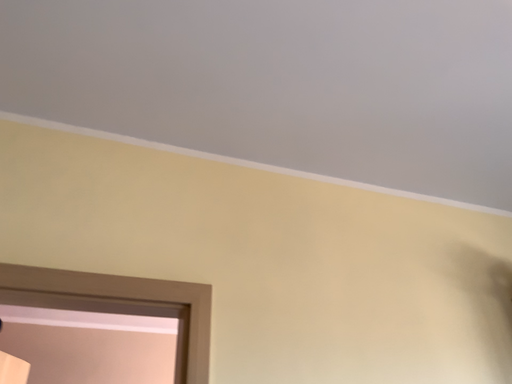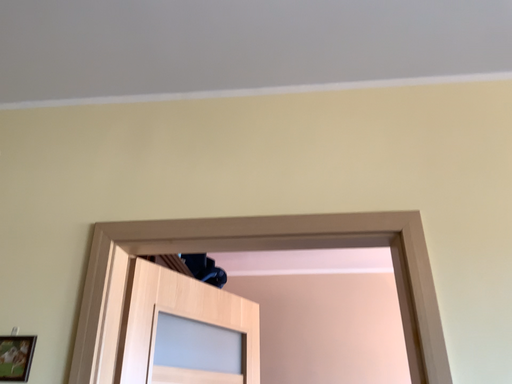
Question: Which way did the camera rotate in the video?

Choices:
 (A) rotated downward
 (B) rotated upward

Answer: (A)